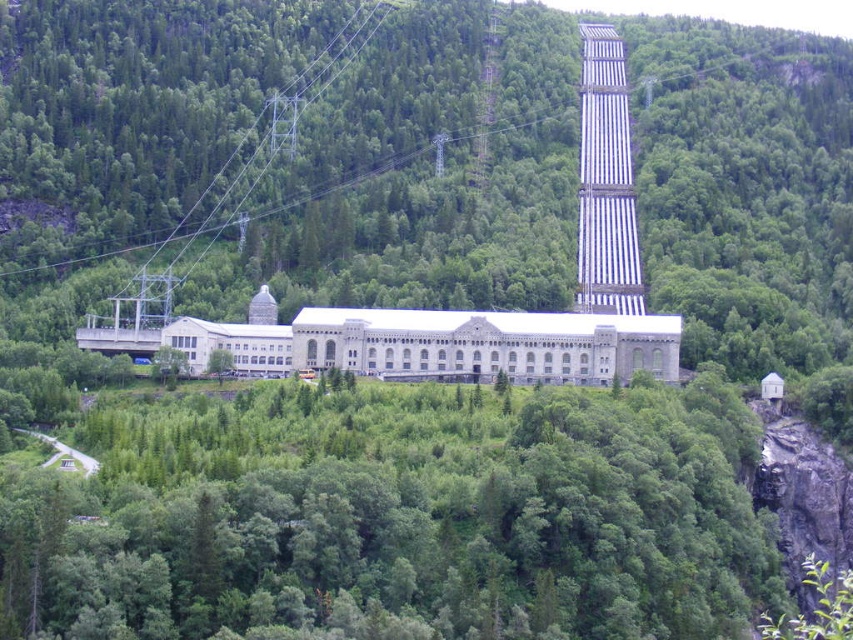
Question: Which is nearer to the green leafy tree at center?

Choices:
 (A) green leafy trees at center
 (B) metallic grid tower at center

Answer: (A)

Question: Can you confirm if green leafy trees at center is smaller than metallic grid tower at center?

Choices:
 (A) yes
 (B) no

Answer: (A)

Question: Is metallic grid tower at center above green leafy tree at center?

Choices:
 (A) yes
 (B) no

Answer: (A)

Question: Is green leafy trees at center bigger than metallic grid tower at center?

Choices:
 (A) yes
 (B) no

Answer: (B)

Question: Considering the real-world distances, which object is farthest from the metallic grid tower at center?

Choices:
 (A) green leafy trees at center
 (B) green leafy tree at center

Answer: (B)

Question: Which point appears farthest from the camera in this image?

Choices:
 (A) (213, 372)
 (B) (592, 113)

Answer: (B)